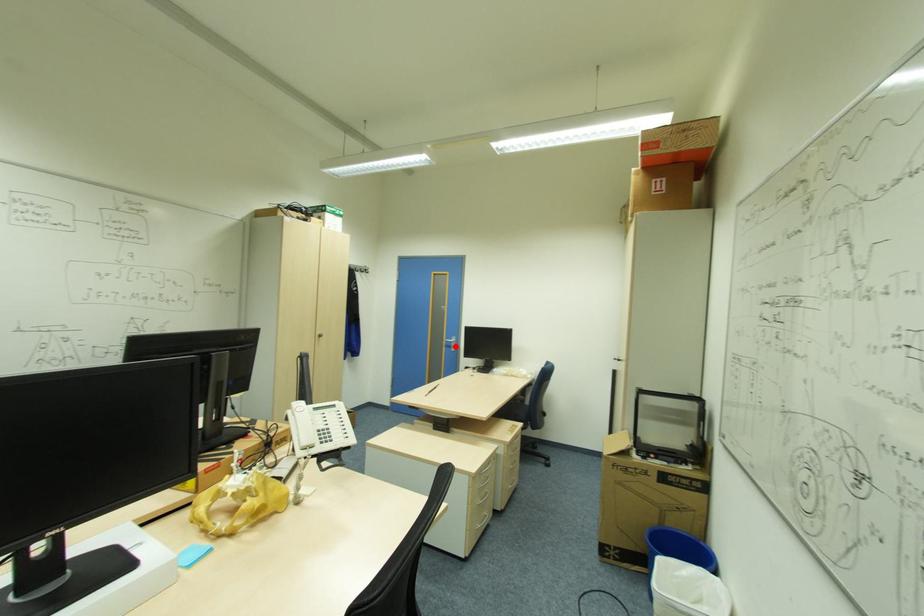
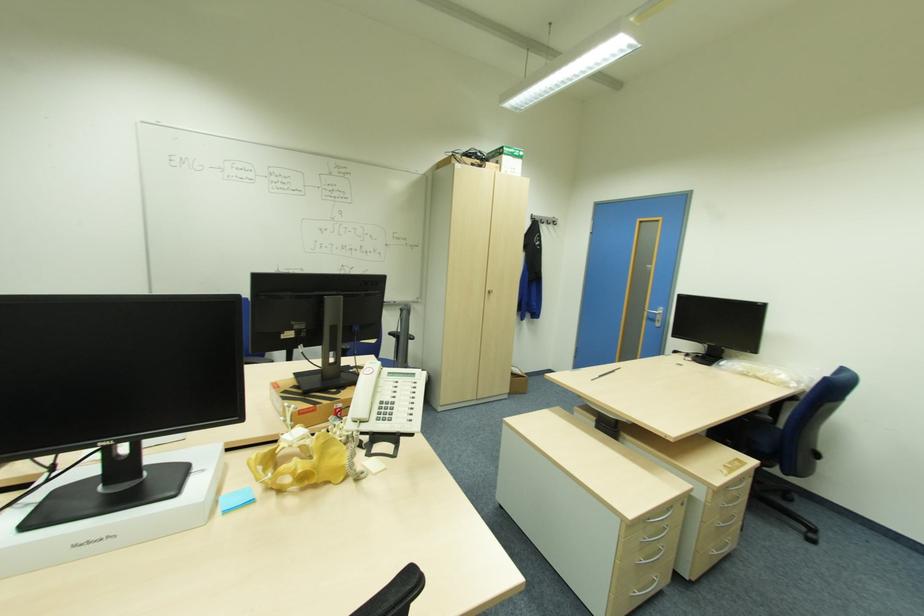
Question: I am providing you with two images of the same scene from different viewpoints. Image1 has a red point marked. In image2, the corresponding 3D location appears at what relative position? Reply with the corresponding letter.

Choices:
 (A) Closer
 (B) Farther

Answer: (A)